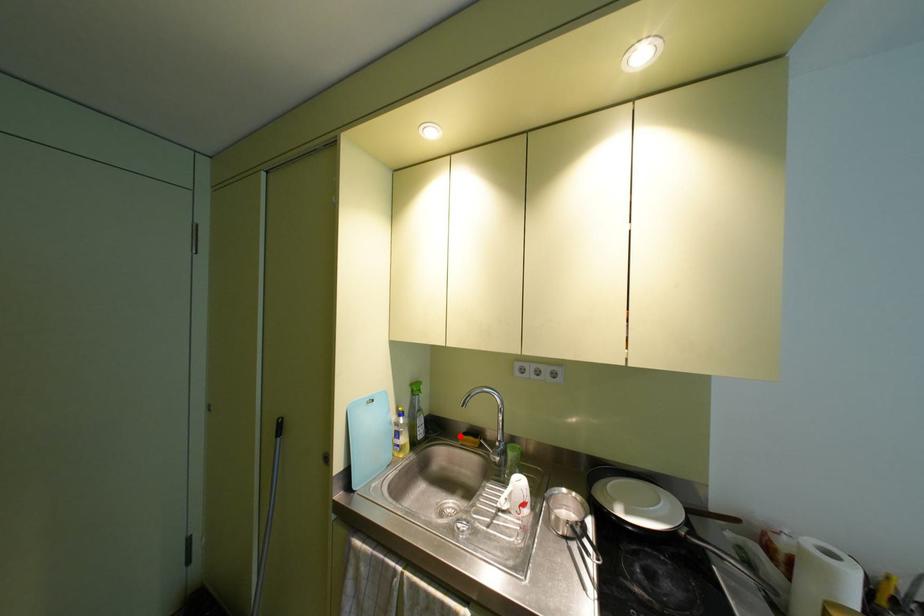
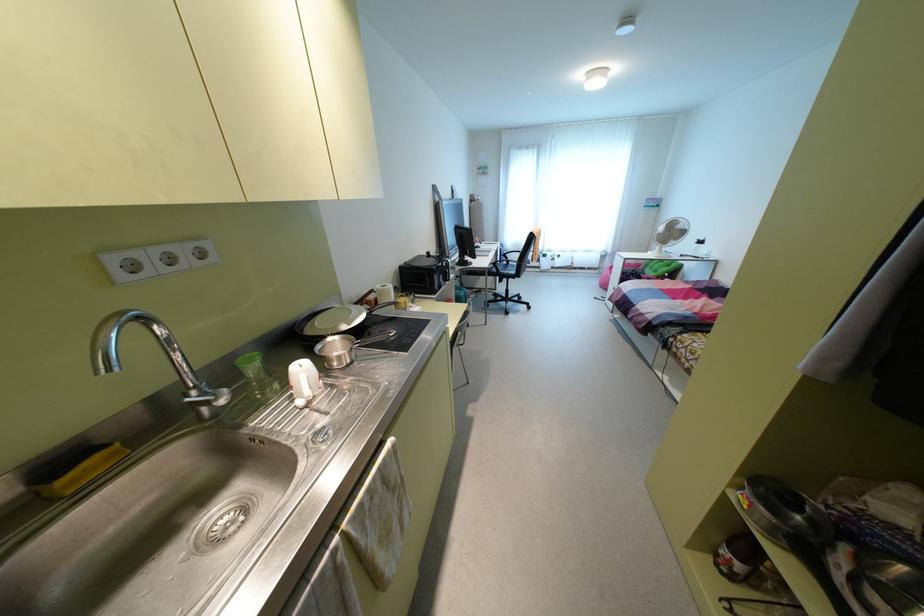
Question: I am providing you with two images of the same scene from different viewpoints. In image1, a red point is highlighted. Considering the same 3D point in image2, which of the following is correct?

Choices:
 (A) It is closer
 (B) It is farther

Answer: (A)